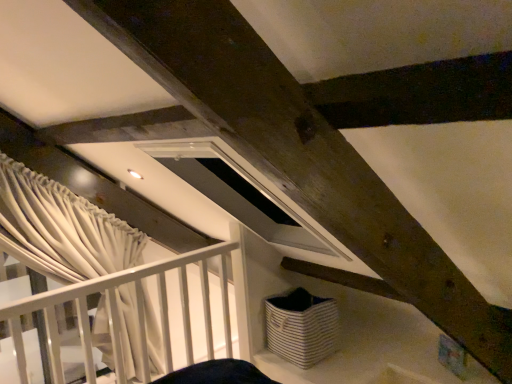
Question: Is white textured curtain at left situated inside white matte rail at left or outside?

Choices:
 (A) inside
 (B) outside

Answer: (B)

Question: Based on their sizes in the image, would you say white textured curtain at left is bigger or smaller than white matte rail at left?

Choices:
 (A) small
 (B) big

Answer: (A)

Question: Which of these objects is positioned farthest from the white matte rail at left?

Choices:
 (A) white striped fabric basket at lower center
 (B) white textured curtain at left

Answer: (A)

Question: Based on their relative distances, which object is nearer to the white textured curtain at left?

Choices:
 (A) white striped fabric basket at lower center
 (B) white matte rail at left

Answer: (B)